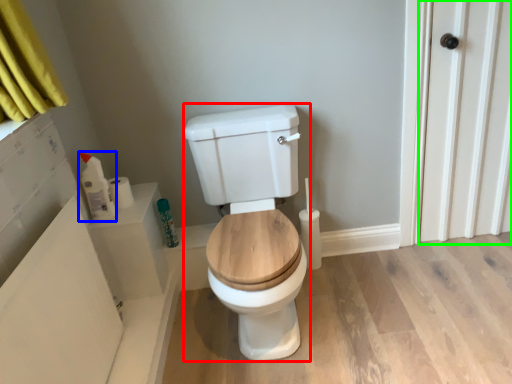
Question: Considering the real-world distances, which object is farthest from porcelain (highlighted by a red box)? toiletry (highlighted by a blue box) or screen door (highlighted by a green box)?

Choices:
 (A) toiletry
 (B) screen door

Answer: (B)